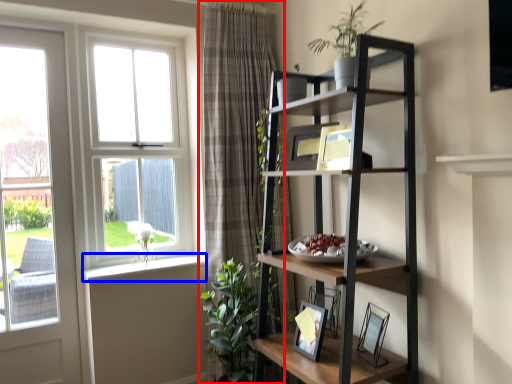
Question: Which object is further to the camera taking this photo, curtain (highlighted by a red box) or window sill (highlighted by a blue box)?

Choices:
 (A) curtain
 (B) window sill

Answer: (B)